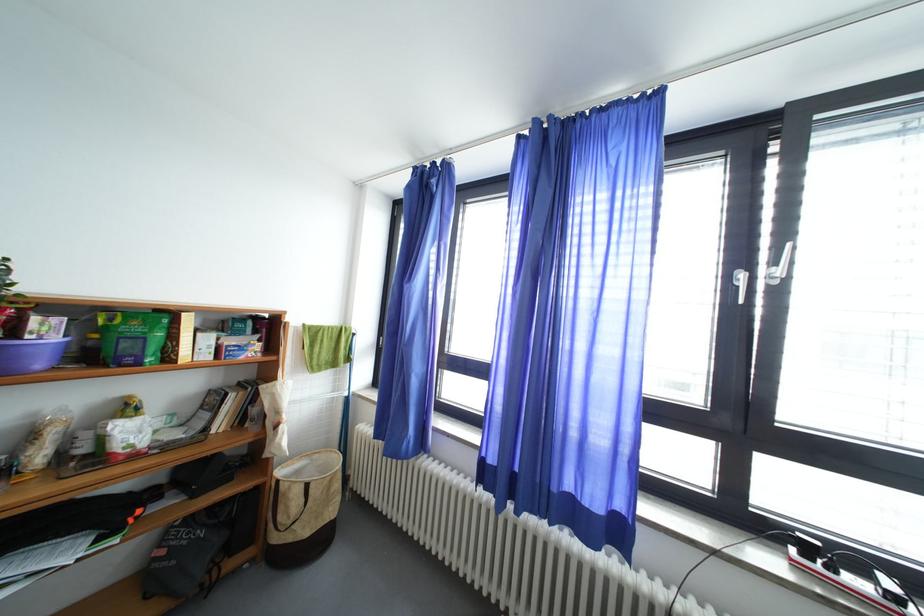
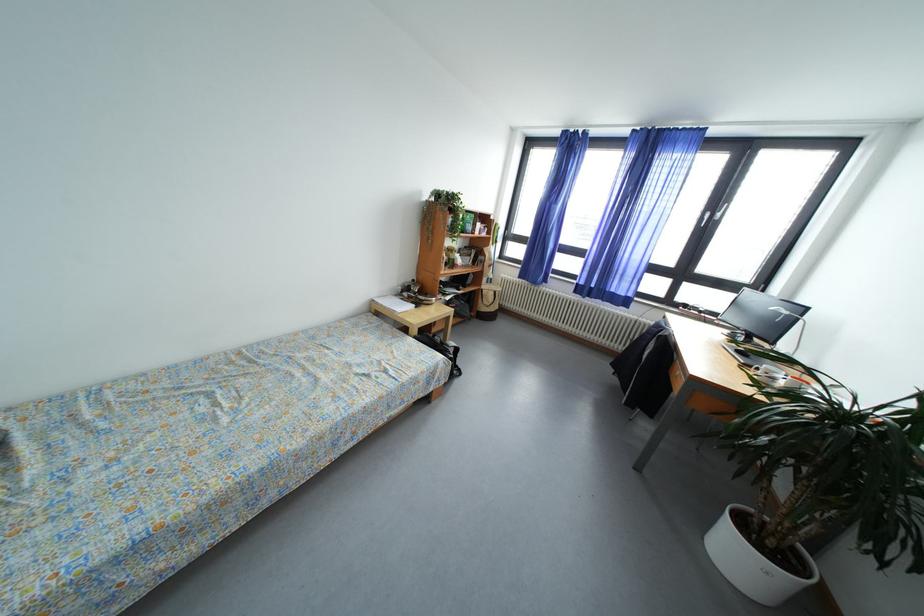
In a continuous first-person perspective shot, in which direction is the camera moving?

The cameraman moved toward left, backward.